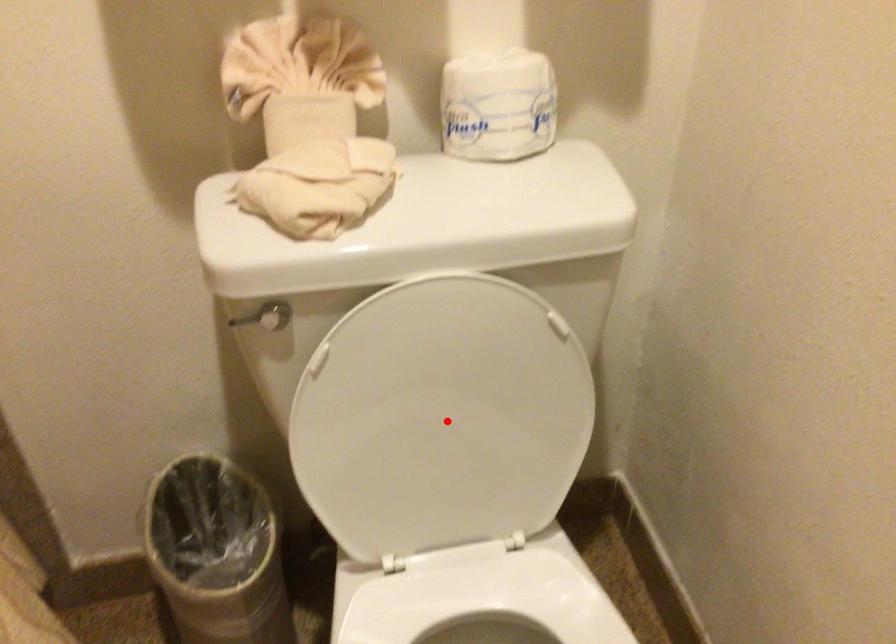
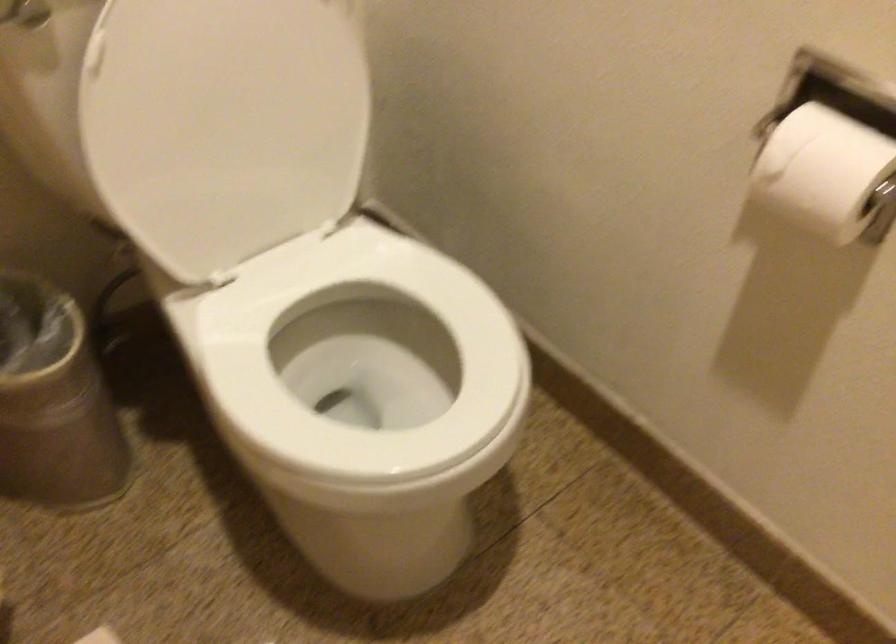
The point at the highlighted location is marked in the first image. Where is the corresponding point in the second image?

(239, 114)